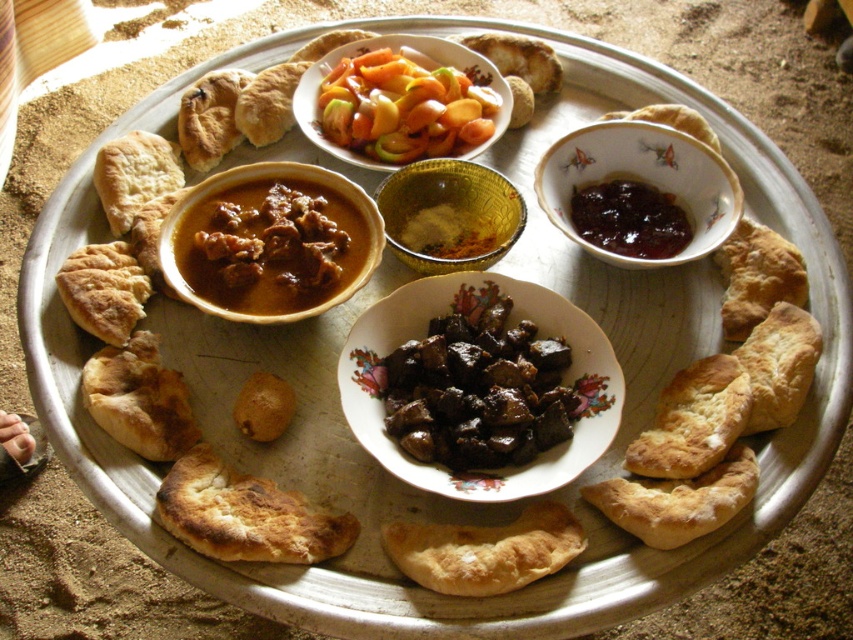
Between point (223, 317) and point (546, 186), which one is positioned in front?

Point (223, 317)

Between brown matte bowl at center and brown glazed bowl at center, which one appears on the left side from the viewer's perspective?

From the viewer's perspective, brown matte bowl at center appears more on the left side.

Describe the element at coordinates (270, 243) in the screenshot. This screenshot has width=853, height=640. I see `brown matte bowl at center` at that location.

Locate an element on the screen. Image resolution: width=853 pixels, height=640 pixels. brown matte bowl at center is located at coordinates (270, 243).

Is brown matte bowl at center to the right of translucent glass bowl at center from the viewer's perspective?

In fact, brown matte bowl at center is to the left of translucent glass bowl at center.

In the scene shown: Who is higher up, brown matte bowl at center or translucent glass bowl at center?

Positioned higher is translucent glass bowl at center.

Describe the element at coordinates (270, 243) in the screenshot. The image size is (853, 640). I see `brown matte bowl at center` at that location.

Where is `brown matte bowl at center`? The width and height of the screenshot is (853, 640). brown matte bowl at center is located at coordinates (270, 243).

Does gold textured bowl at center lie in front of dark glossy jam at upper right?

Yes, it is.

Is point (500, 237) positioned before point (601, 209)?

Yes, point (500, 237) is in front of point (601, 209).

Is point (453, 208) farther from camera compared to point (608, 248)?

Yes, point (453, 208) is behind point (608, 248).

I want to click on gold textured bowl at center, so (x=450, y=216).